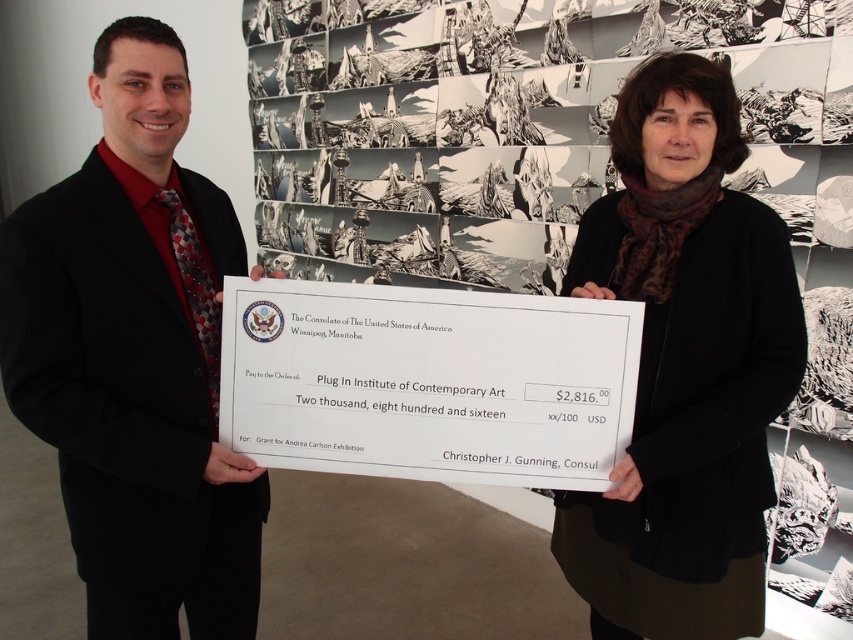
Question: Is black suit at center bigger than black woolen sweater at center?

Choices:
 (A) no
 (B) yes

Answer: (B)

Question: Does black suit at center have a lesser width compared to black woolen sweater at center?

Choices:
 (A) no
 (B) yes

Answer: (A)

Question: Which of the following is the closest to the observer?

Choices:
 (A) (650, 481)
 (B) (219, 637)

Answer: (A)

Question: Can you confirm if black suit at center is positioned below black woolen sweater at center?

Choices:
 (A) no
 (B) yes

Answer: (A)

Question: Which point is farther to the camera?

Choices:
 (A) black suit at center
 (B) black woolen sweater at center

Answer: (B)